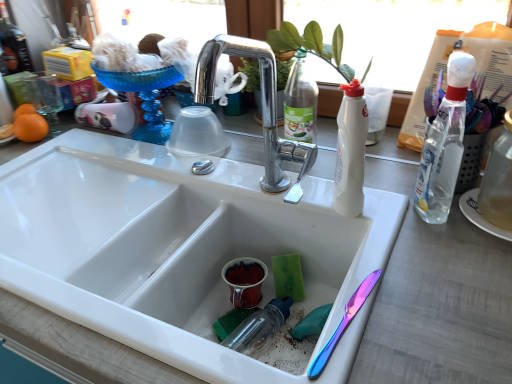
Where is `free spot in front of orange matte at left`? This screenshot has width=512, height=384. free spot in front of orange matte at left is located at coordinates (35, 174).